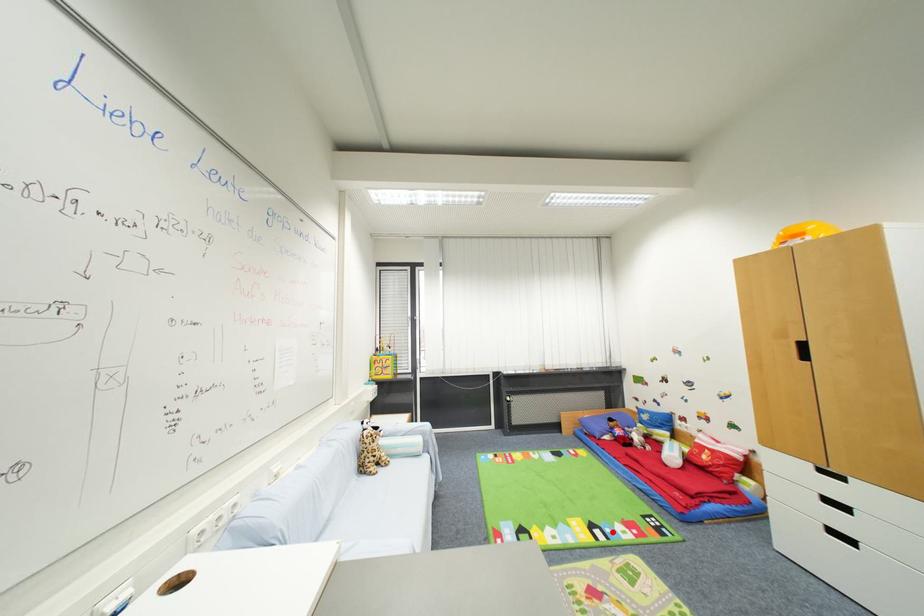
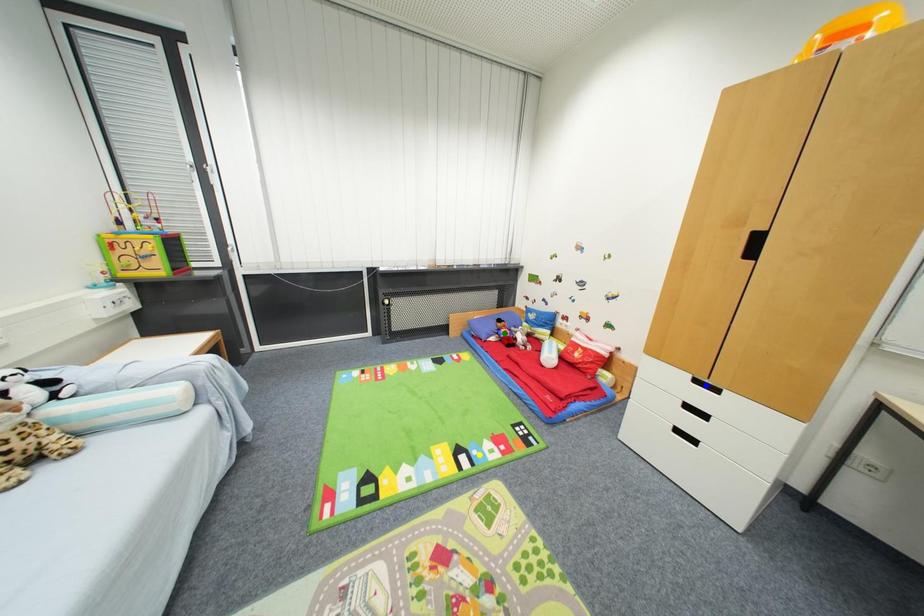
Question: I am providing you with two images of the same scene from different viewpoints. A red point is marked on the first image. You are given multiple points on the second image. Which point in image 2 is actually the same real-world point as the red point in image 1?

Choices:
 (A) blue point
 (B) yellow point
 (C) green point

Answer: (B)